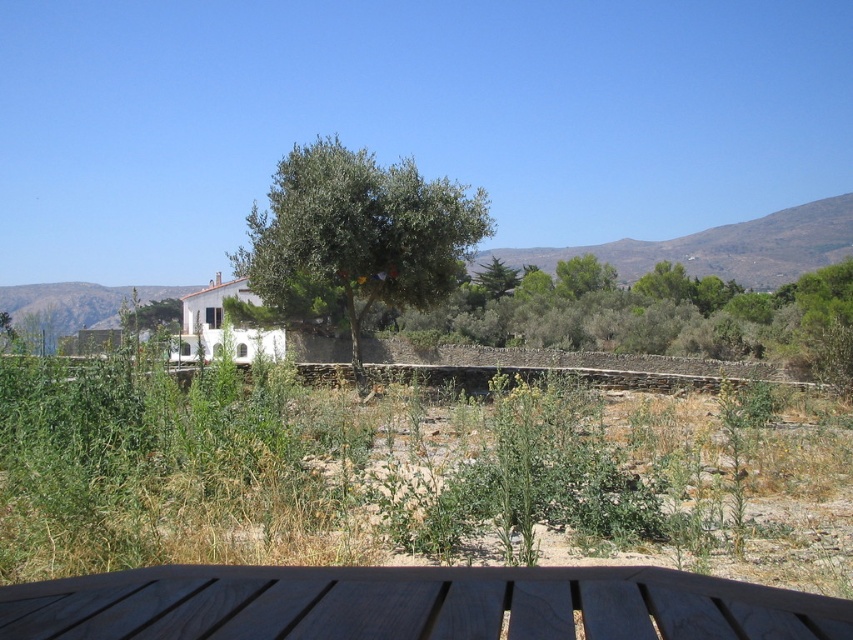
Between wooden picnic table at lower center and green leafy olive tree at center, which one is positioned lower?

wooden picnic table at lower center is lower down.

Can you confirm if wooden picnic table at lower center is bigger than green leafy olive tree at center?

No, wooden picnic table at lower center is not bigger than green leafy olive tree at center.

What do you see at coordinates (412, 604) in the screenshot? This screenshot has width=853, height=640. I see `wooden picnic table at lower center` at bounding box center [412, 604].

In order to click on wooden picnic table at lower center in this screenshot , I will do `click(412, 604)`.